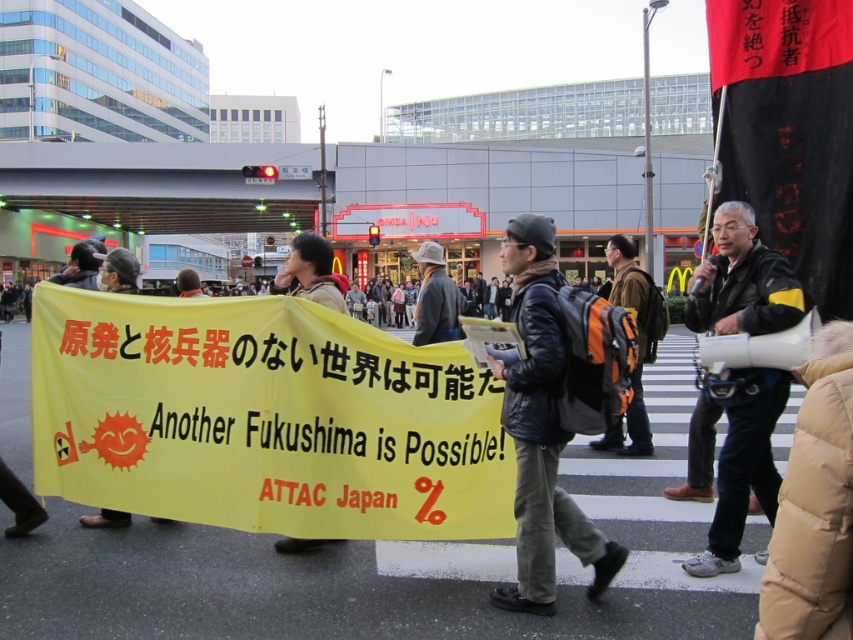
You are a photographer trying to capture the protesters in the crosswalk. You notice the black leather jacket at center and the yellow paper banner at center. Which object should you focus on to ensure it fits entirely within your camera frame if your frame can only accommodate the narrower of the two?

The black leather jacket at center has a lesser width compared to the yellow paper banner at center, so you should focus on the black leather jacket at center to ensure it fits entirely within your camera frame.

You are a photographer at the protest scene. You want to take a photo of both the dark blue leather jacket at center and the black leather jacket at center. Which jacket should you focus on first if you want to capture the smaller one in detail?

The dark blue leather jacket at center is smaller than the black leather jacket at center, so you should focus on the dark blue leather jacket at center first to capture the smaller one in detail.

You are a photographer standing on the sidewalk observing the protest. You want to capture a photo that includes both the black leather jacket at center and the yellow paper banner at center. Based on their positions, which object should you focus on first to ensure both are in the frame?

The black leather jacket at center is below the yellow paper banner at center, so you should focus on the yellow paper banner at center first to ensure both are in the frame.